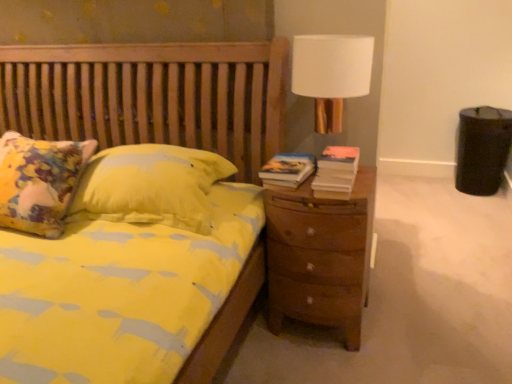
Question: Is brown wooden nightstand at right taller or shorter than hardcover book at right, which is the 2th book in right-to-left order?

Choices:
 (A) tall
 (B) short

Answer: (A)

Question: Considering the positions of brown wooden nightstand at right and hardcover book at right, the 1th book positioned from the left, in the image, is brown wooden nightstand at right wider or thinner than hardcover book at right, the 1th book positioned from the left,?

Choices:
 (A) wide
 (B) thin

Answer: (A)

Question: Which of these objects is positioned closest to the hardcover book at right, the first book positioned from the right?

Choices:
 (A) hardcover book at right, which is the 2th book in right-to-left order
 (B) white fabric lampshade at upper right
 (C) brown wooden nightstand at right

Answer: (A)

Question: Estimate the real-world distances between objects in this image. Which object is farther from the white fabric lampshade at upper right?

Choices:
 (A) brown wooden nightstand at right
 (B) hardcover book at right, which is the 2th book in right-to-left order
 (C) hardcover book at right, the first book positioned from the right

Answer: (A)